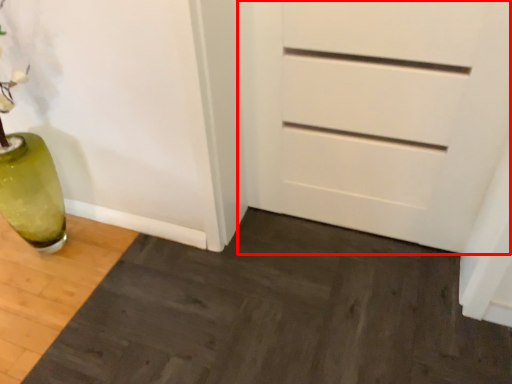
Question: In this image, where is chest of drawers (annotated by the red box) located relative to doormat?

Choices:
 (A) left
 (B) right

Answer: (B)